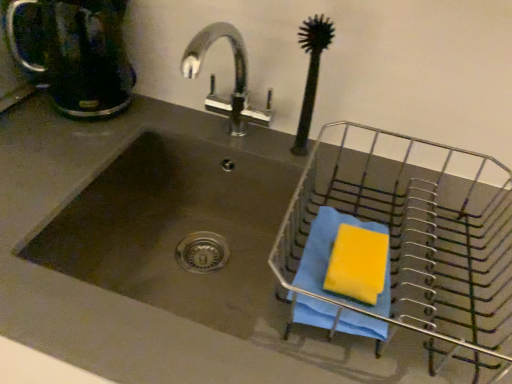
You are a GUI agent. You are given a task and a screenshot of the screen. Output one action in this format:
    pyautogui.click(x=<x>, y=<y>)
    Task: Click on the unoccupied space behind metallic wire basket at right
    The width and height of the screenshot is (512, 384).
    Given the screenshot: What is the action you would take?
    pyautogui.click(x=381, y=168)